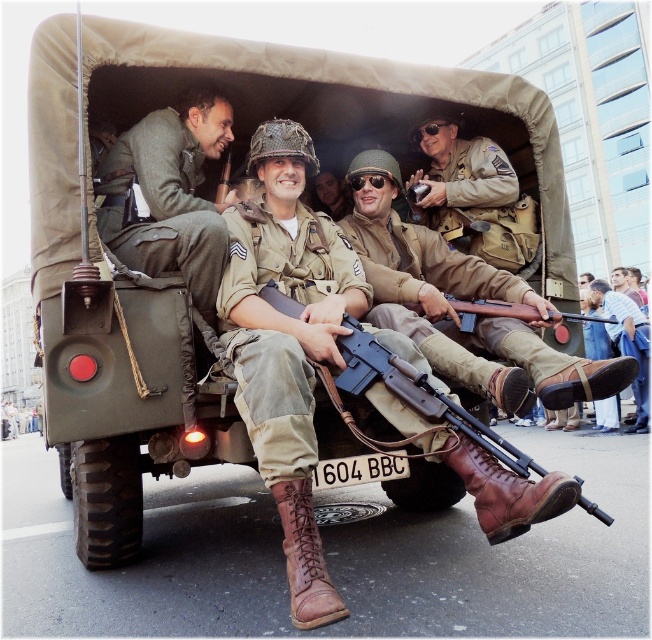
You are a photographer positioned at the front of the jeep. You want to capture a closeup shot of the matte brown leather boots at center. What coordinate should your camera focus on?

The matte brown leather boots at center are located at coordinate point [288,342], so the camera should focus on that point.

You are a photographer positioned 2 meters away from the vintage military vehicle. You want to take a photo of the tan leather boots at center and matte green uniform at center so that both are clearly visible. Given that your camera has a minimum focus distance of 1.5 meters, will you be able to capture both objects in focus without moving closer?

The tan leather boots at center is 1.38 meters from matte green uniform at center. Since your camera requires a minimum focus distance of 1.5 meters to capture both objects clearly, the distance between them is insufficient. Therefore, you need to move closer to ensure both are in focus.

You are a costume designer preparing for a historical reenactment. You need to ensure that the tan leather boots at center and the matte green uniform at center are proportionate. Which object is taller?

The tan leather boots at center are much taller than the matte green uniform at center.